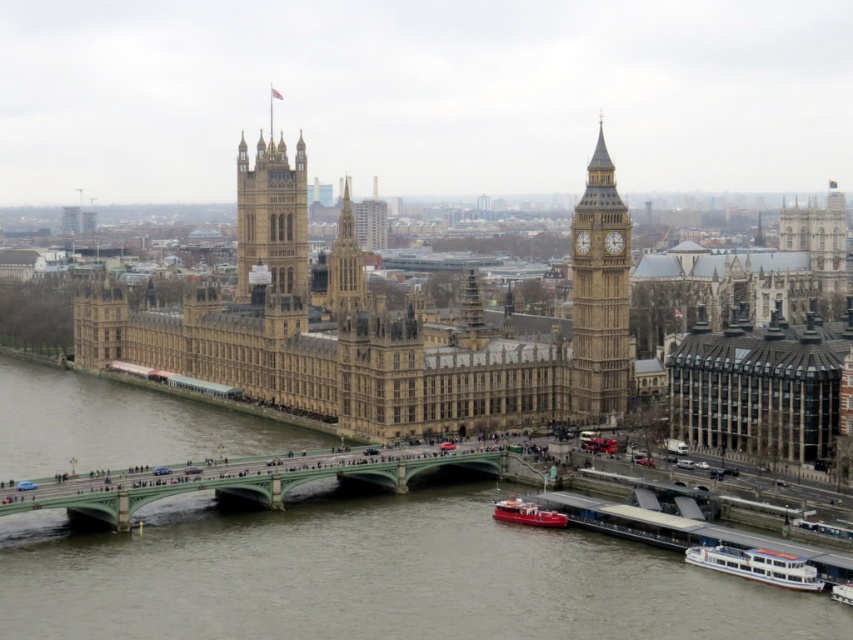
You are a tourist standing on the green bridge over the River Thames. You notice the brown stone water at lower center and the golden stone tower at center. Which object is closer to your current position on the bridge?

The brown stone water at lower center is closer to your current position on the bridge because it is located below the golden stone tower at center, placing it nearer to the bridge level.

You are a photographer planning to take a photo of the Palace of Westminster with the white glossy boat at lower right and the white plastic boat at lower right in the foreground. Which boat will appear bigger in the photo?

The white glossy boat at lower right will appear bigger in the photo because it has a larger size compared to the white plastic boat at lower right.

In the scene shown: Based on the scene description, what object is located at the coordinates point (757, 564)?

The white glossy boat at lower right is located at point (757, 564).